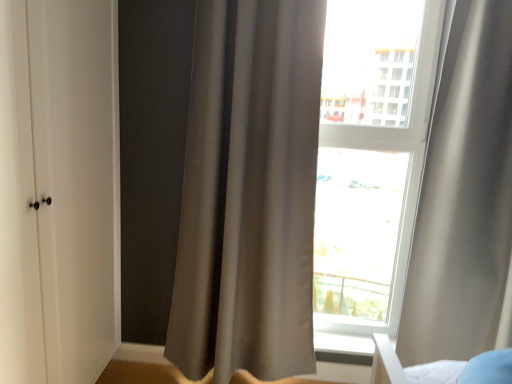
Question: Would you consider matte gray curtain at center, which is the first curtain from left to right, to be distant from satin gray curtain at right, arranged as the second curtain when viewed from the left?

Choices:
 (A) yes
 (B) no

Answer: (B)

Question: From a real-world perspective, does matte gray curtain at center, which is the first curtain from left to right, sit lower than satin gray curtain at right, arranged as the second curtain when viewed from the left?

Choices:
 (A) no
 (B) yes

Answer: (B)

Question: Is matte gray curtain at center, which ranks as the 2th curtain in right-to-left order, shorter than satin gray curtain at right, the first curtain viewed from the right?

Choices:
 (A) yes
 (B) no

Answer: (B)

Question: Can you confirm if matte gray curtain at center, which is the first curtain from left to right, is smaller than satin gray curtain at right, the first curtain viewed from the right?

Choices:
 (A) no
 (B) yes

Answer: (A)

Question: From the image's perspective, is matte gray curtain at center, which ranks as the 2th curtain in right-to-left order, below satin gray curtain at right, arranged as the second curtain when viewed from the left?

Choices:
 (A) yes
 (B) no

Answer: (B)

Question: Does matte gray curtain at center, which is the first curtain from left to right, have a larger size compared to satin gray curtain at right, arranged as the second curtain when viewed from the left?

Choices:
 (A) no
 (B) yes

Answer: (B)

Question: Can you confirm if satin gray curtain at right, arranged as the second curtain when viewed from the left, is shorter than white matte cabinet at left?

Choices:
 (A) yes
 (B) no

Answer: (A)

Question: Is satin gray curtain at right, the first curtain viewed from the right, closer to the viewer compared to white matte cabinet at left?

Choices:
 (A) yes
 (B) no

Answer: (B)

Question: Is satin gray curtain at right, arranged as the second curtain when viewed from the left, to the right of white matte cabinet at left from the viewer's perspective?

Choices:
 (A) no
 (B) yes

Answer: (B)

Question: From a real-world perspective, is satin gray curtain at right, the first curtain viewed from the right, physically above white matte cabinet at left?

Choices:
 (A) no
 (B) yes

Answer: (B)

Question: Is satin gray curtain at right, arranged as the second curtain when viewed from the left, wider than white matte cabinet at left?

Choices:
 (A) no
 (B) yes

Answer: (B)

Question: From a real-world perspective, is satin gray curtain at right, the first curtain viewed from the right, beneath white matte cabinet at left?

Choices:
 (A) yes
 (B) no

Answer: (B)

Question: From the image's perspective, is white matte cabinet at left on transparent glass window at center?

Choices:
 (A) no
 (B) yes

Answer: (A)